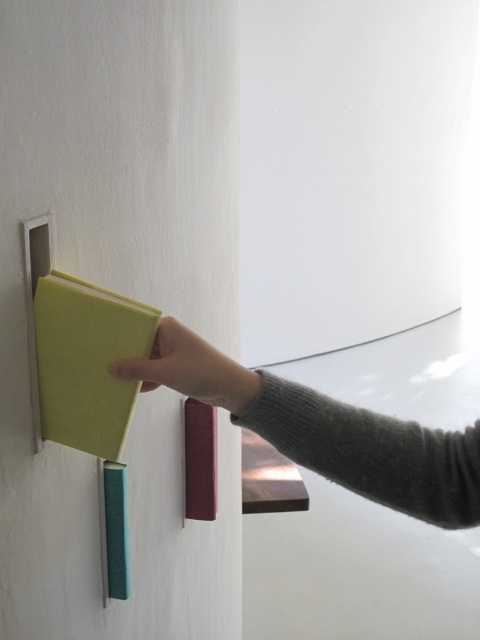
Question: Which point is farther to the camera?

Choices:
 (A) matte green book at center
 (B) gray wool sweater at upper center

Answer: (B)

Question: Which point is closer to the camera?

Choices:
 (A) (54, 380)
 (B) (201, 372)

Answer: (B)

Question: Is gray wool sweater at upper center positioned before green felt folder at upper left?

Choices:
 (A) no
 (B) yes

Answer: (A)

Question: Which object is closer to the camera taking this photo?

Choices:
 (A) green felt folder at upper left
 (B) matte green book at center

Answer: (A)

Question: Is gray wool sweater at upper center to the left of green felt folder at upper left from the viewer's perspective?

Choices:
 (A) yes
 (B) no

Answer: (B)

Question: Does green felt folder at upper left have a smaller size compared to matte green book at center?

Choices:
 (A) no
 (B) yes

Answer: (A)